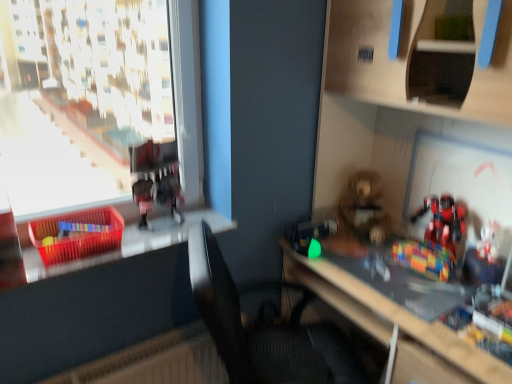
This screenshot has width=512, height=384. In order to click on free space above translucent plastic basket at left (from a real-world perspective) in this screenshot , I will do `click(129, 242)`.